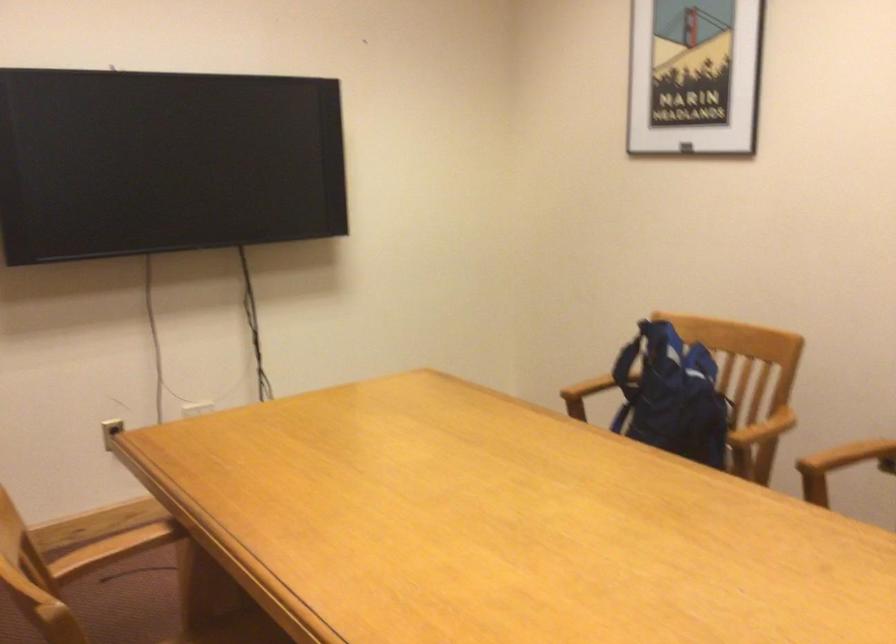
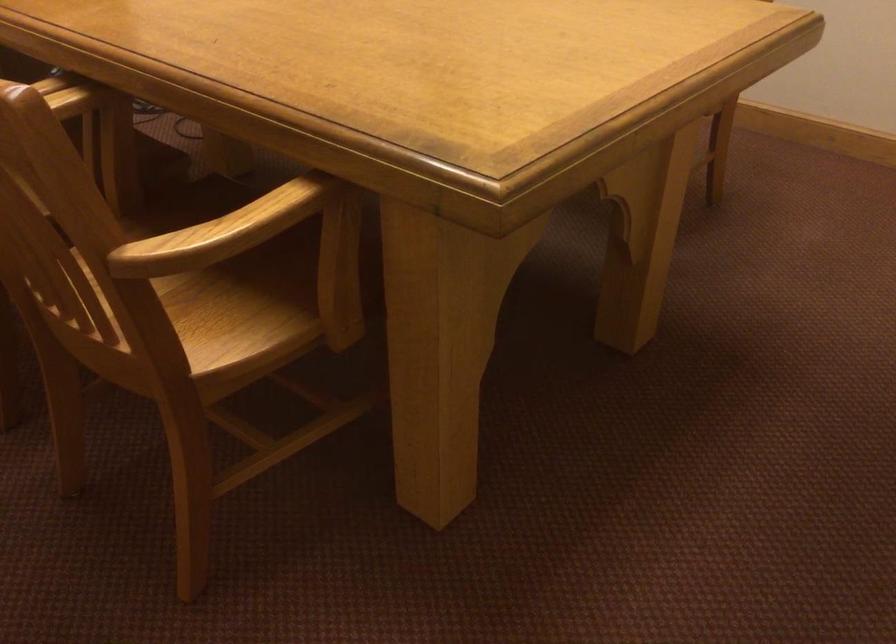
Question: What movement of the cameraman would produce the second image?

Choices:
 (A) Left
 (B) Right
 (C) Forward
 (D) Backward

Answer: (D)